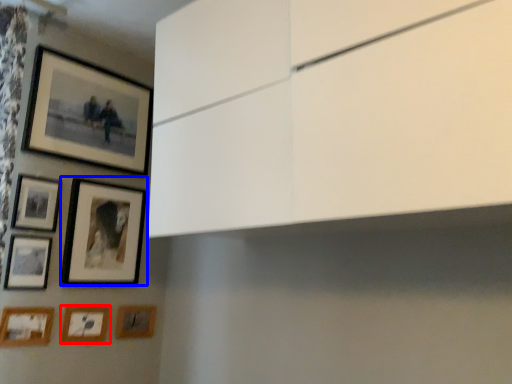
Question: Which object appears closest to the camera in this image, picture frame (highlighted by a red box) or picture frame (highlighted by a blue box)?

Choices:
 (A) picture frame
 (B) picture frame

Answer: (B)